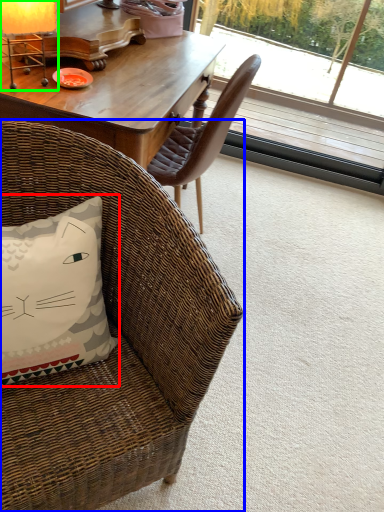
Question: Estimate the real-world distances between objects in this image. Which object is closer to pillow (highlighted by a red box), chair (highlighted by a blue box) or table lamp (highlighted by a green box)?

Choices:
 (A) chair
 (B) table lamp

Answer: (A)